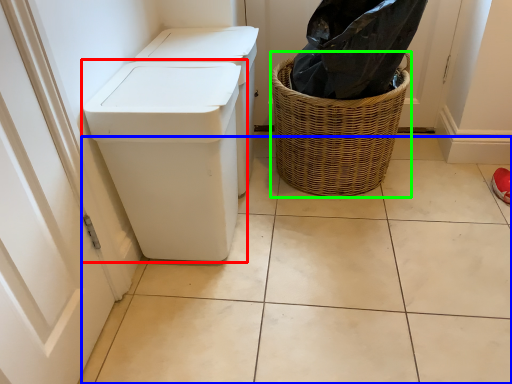
Question: Based on their relative distances, which object is nearer to waste container (highlighted by a red box)? Choose from tile (highlighted by a blue box) and basket (highlighted by a green box).

Choices:
 (A) tile
 (B) basket

Answer: (A)